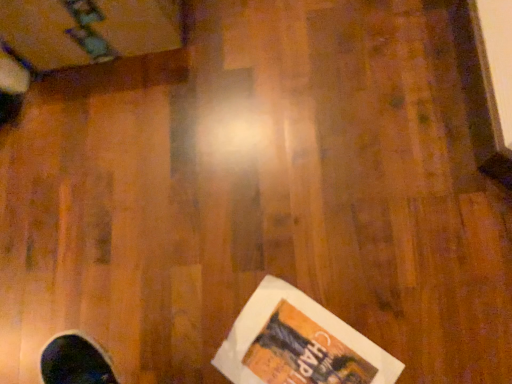
This screenshot has height=384, width=512. I want to click on vacant point to the right of white paper flyer at lower right, so click(407, 289).